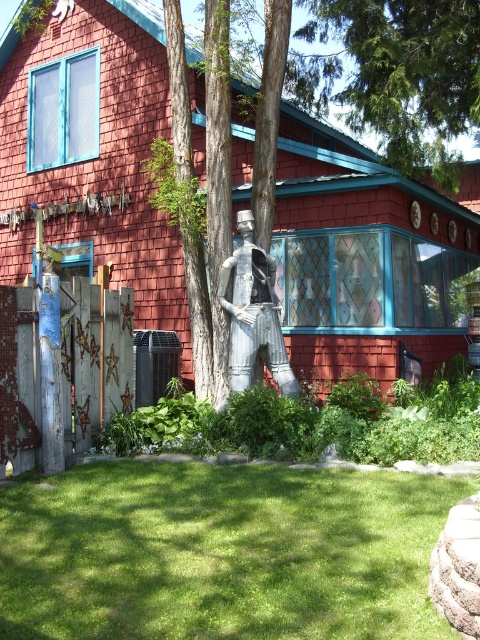
You are a gardener who needs to plant a new flower bed between the smooth bark tree at center and the green grass at center. How much space do you have to work with?

The smooth bark tree at center and the green grass at center are 5.36 meters apart from each other, so you have 5.36 meters of space to work with for the flower bed.

You are standing in front of the red shingled house and want to place a small garden ornament. You have two options to place it on the green grass at center or the metallic statue at center. Which location is closer to you?

The green grass at center is closer to the viewer than the metallic statue at center, so placing the ornament on the green grass at center would be closer to you.

You are standing at the origin point of the coordinate system. You want to walk to the smooth bark tree at center. Which direction should you walk to reach it?

The smooth bark tree at center is located at coordinate point (92, 145), so you should walk towards the direction of positive x and positive y axes to reach it.